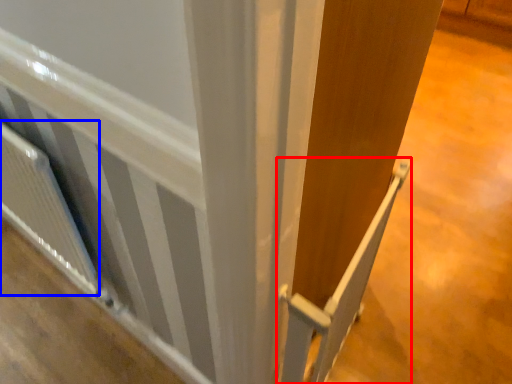
Question: Among these objects, which one is nearest to the camera, rail (highlighted by a red box) or radiator (highlighted by a blue box)?

Choices:
 (A) rail
 (B) radiator

Answer: (A)